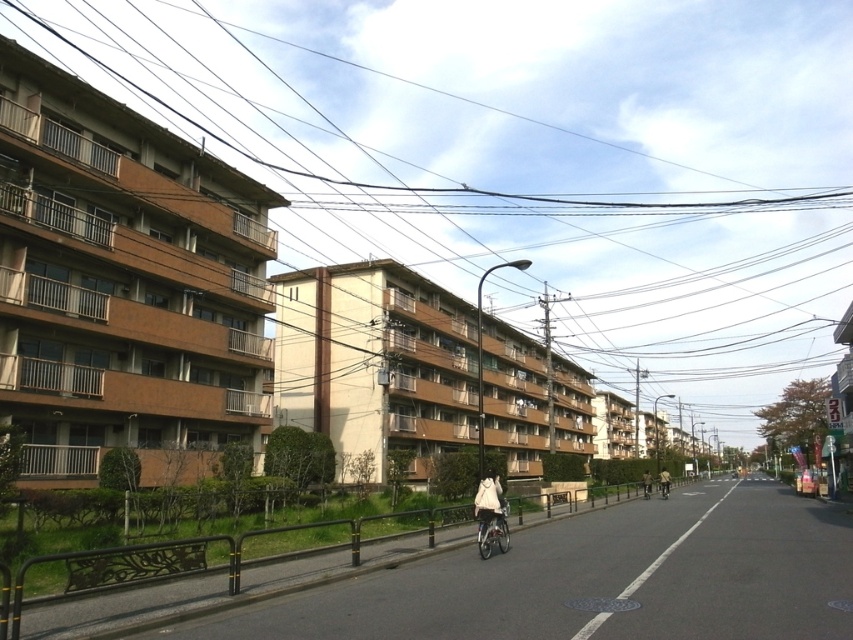
You are standing at the edge of the street and see both the metallic silver bicycle at center and the khaki fabric jacket at center. Which object is closer to you?

The metallic silver bicycle at center is 27.93 meters away from the khaki fabric jacket at center, but the question does not provide information about their distances from you. Without knowing your position relative to both objects, it is impossible to determine which is closer.

You are a delivery person carrying a package and need to walk through the street shown in the image. There is a brown wire at upper center and a white matte jacket at center in your path. Based on their widths, can you safely pass between them without touching either?

The brown wire at upper center might be wider than the white matte jacket at center, so there is a possibility that the space between them is not sufficient for safe passage. It would be safer to detour around the area to avoid contact.

You are a delivery person who needs to deliver a package to the person wearing the white matte jacket at center. You are currently standing next to the metallic silver bicycle at center. Which direction should you move to reach the person?

The white matte jacket at center is to the right of the metallic silver bicycle at center, so you should move to the right to reach the person wearing the white matte jacket at center.